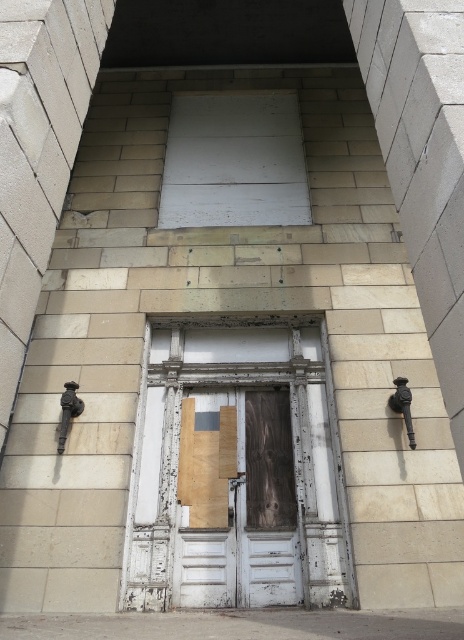
Is wooden door at center further to camera compared to white matte board at upper center?

That is False.

Which is behind, point (264, 584) or point (231, 141)?

Point (231, 141)

What are the coordinates of `wooden door at center` in the screenshot? It's located at (239, 506).